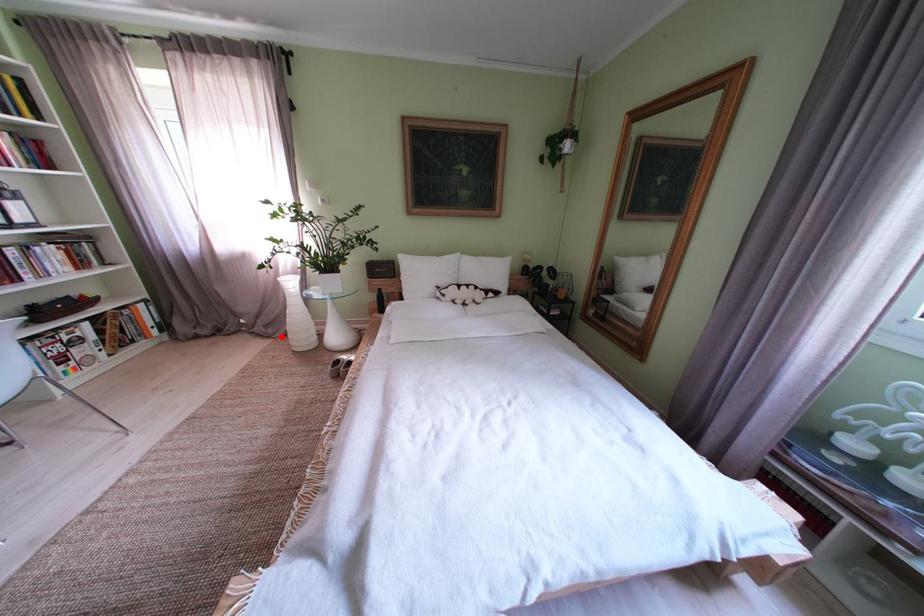
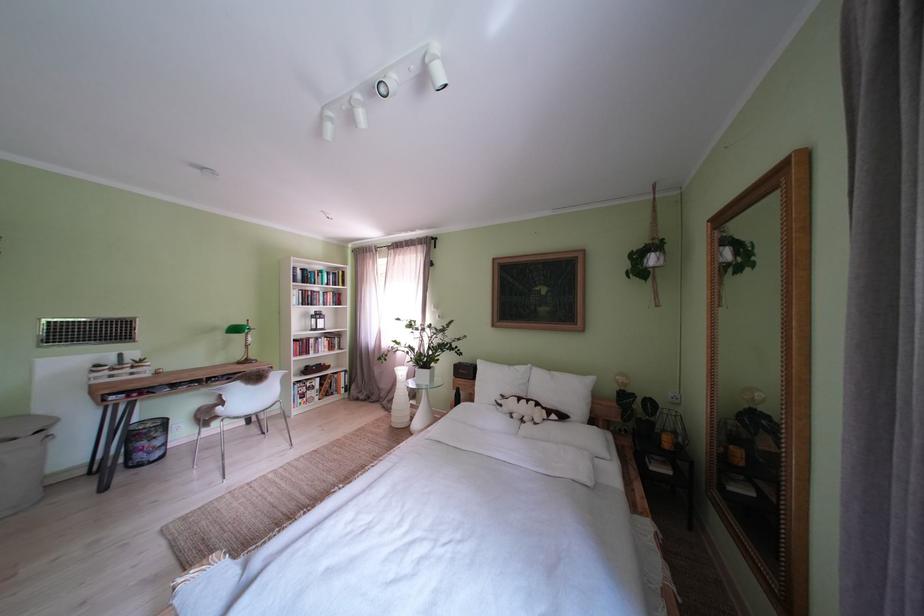
In the second image, find the point that corresponds to the highlighted location in the first image.

(400, 411)